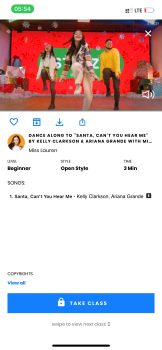
Image resolution: width=162 pixels, height=350 pixels. I want to click on sound control, so click(x=146, y=95).